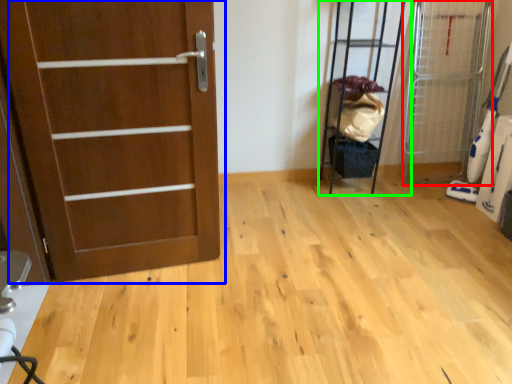
Question: Which object is positioned closest to elevator (highlighted by a red box)? Select from door (highlighted by a blue box) and elevator (highlighted by a green box).

Choices:
 (A) door
 (B) elevator

Answer: (B)